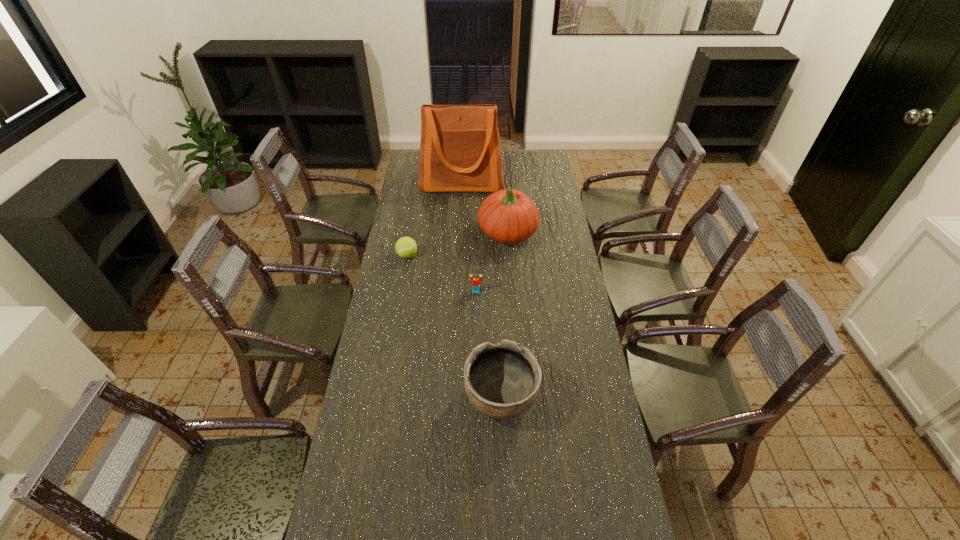
In order to click on shopping bag in this screenshot , I will do `click(460, 151)`.

What are the coordinates of `the tallest object` in the screenshot? It's located at (460, 151).

Locate an element on the screen. This screenshot has height=540, width=960. pumpkin is located at coordinates (509, 216).

Image resolution: width=960 pixels, height=540 pixels. Identify the location of the third tallest object. (502, 381).

Identify the location of pottery. Image resolution: width=960 pixels, height=540 pixels. (502, 381).

You are a GUI agent. You are given a task and a screenshot of the screen. Output one action in this format:
    pyautogui.click(x=<x>, y=<y>)
    Task: Click on the tennis ball
    
    Given the screenshot: What is the action you would take?
    pyautogui.click(x=406, y=247)

You are a GUI agent. You are given a task and a screenshot of the screen. Output one action in this format:
    pyautogui.click(x=<x>, y=<y>)
    Task: Click on the fourth farthest object
    The image size is (960, 540).
    Given the screenshot: What is the action you would take?
    pyautogui.click(x=475, y=279)

You are a GUI agent. You are given a task and a screenshot of the screen. Output one action in this format:
    pyautogui.click(x=<x>, y=<y>)
    Task: Click on the free point located on the front pocket of the tallest object
    
    Given the screenshot: What is the action you would take?
    pyautogui.click(x=461, y=208)

I want to click on free space located 0.230m on the back of the pumpkin, so click(505, 187).

Find the location of a particular element. vacant space situated on the front of the third tallest object is located at coordinates (505, 507).